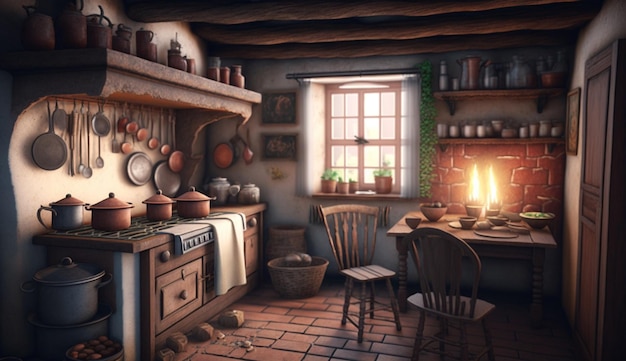
I want to click on closest kettle, so click(x=72, y=302).